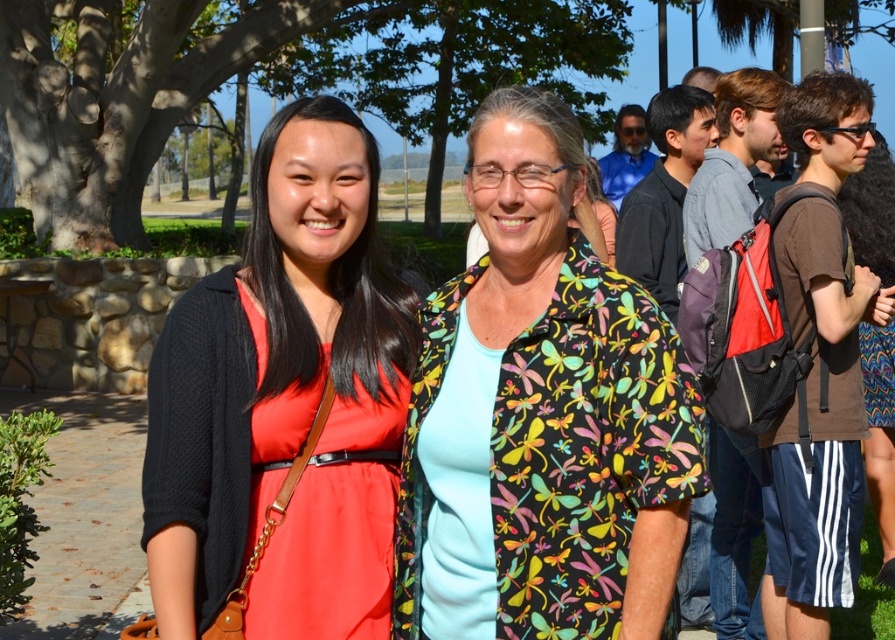
Question: Among these objects, which one is nearest to the camera?

Choices:
 (A) matte black cardigan at center
 (B) multicolored floral shirt at center

Answer: (B)

Question: Considering the relative positions of multicolored floral shirt at center and matte black cardigan at center in the image provided, where is multicolored floral shirt at center located with respect to matte black cardigan at center?

Choices:
 (A) below
 (B) above

Answer: (B)

Question: Which object is closer to the camera taking this photo?

Choices:
 (A) matte black cardigan at center
 (B) multicolored floral shirt at center

Answer: (B)

Question: Is multicolored floral shirt at center behind matte black cardigan at center?

Choices:
 (A) no
 (B) yes

Answer: (A)

Question: Is multicolored floral shirt at center below matte black cardigan at center?

Choices:
 (A) no
 (B) yes

Answer: (A)